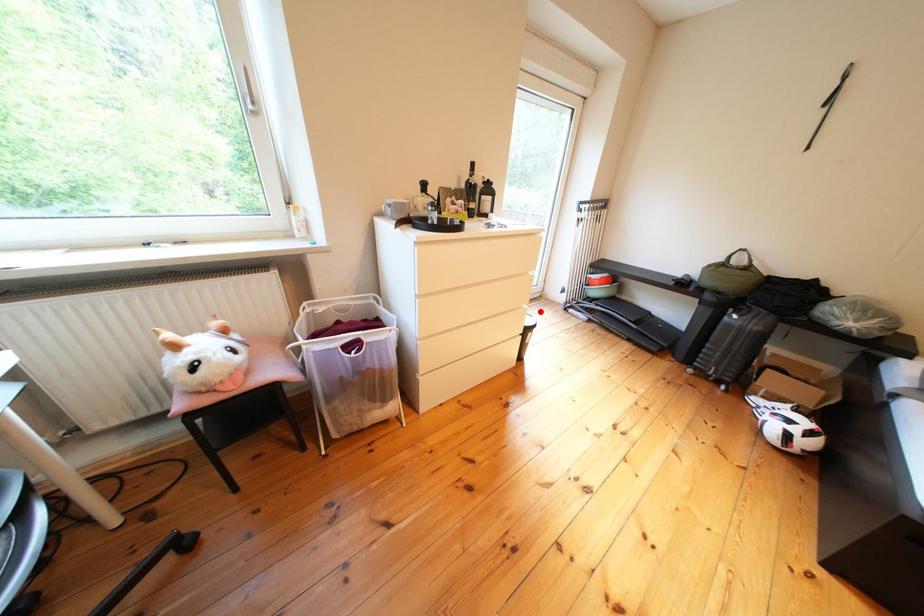
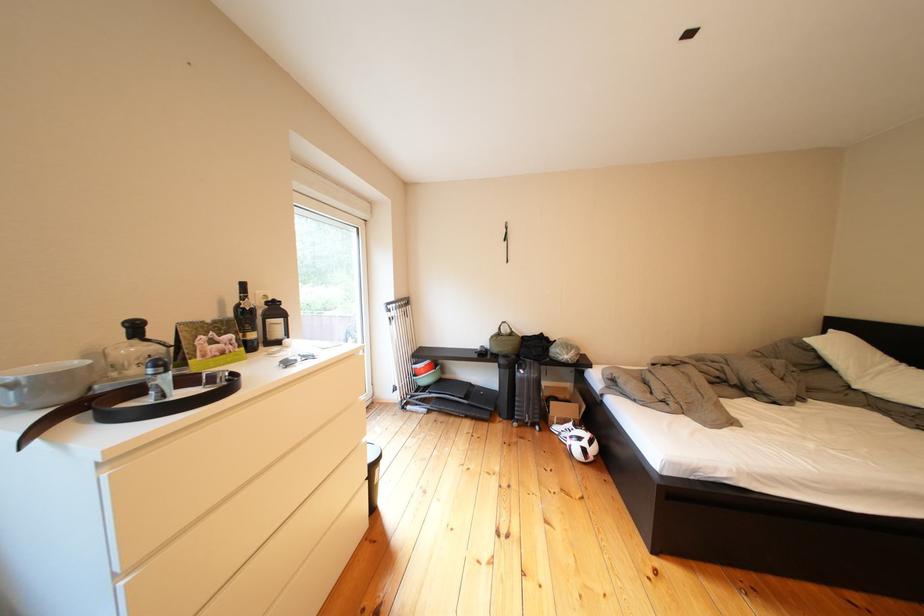
Question: I am providing you with two images of the same scene from different viewpoints. A red point is marked on the first image. Can you still see the location of the red point in image 2?

Choices:
 (A) Yes
 (B) No

Answer: (A)